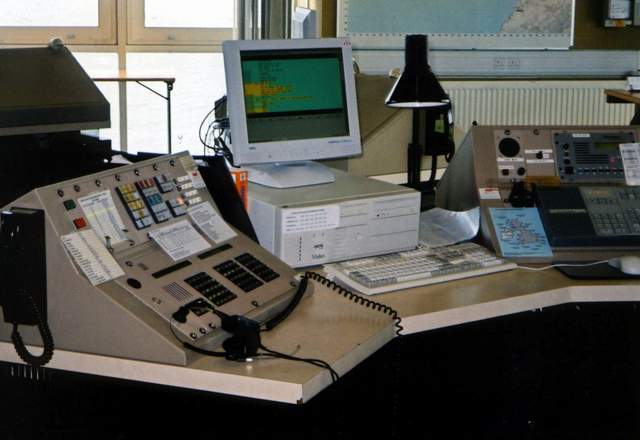
At what (x,y) coordinates should I click in order to perform the action: click on computer monitor. Please return your answer as a coordinate pair (x, y). Looking at the image, I should click on (x=289, y=85).